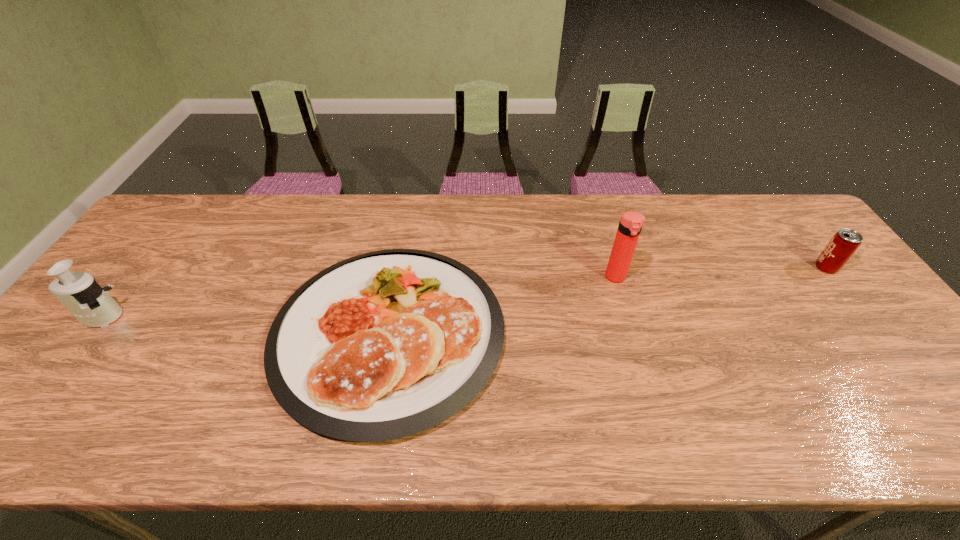
Identify the location of free spot between the thermos bottle and the rightmost object. The width and height of the screenshot is (960, 540). (721, 273).

I want to click on vacant point located between the third tallest object and the third object from right to left, so click(x=608, y=301).

Identify the location of free area in between the second object from left to right and the juicer. The height and width of the screenshot is (540, 960). (245, 325).

Locate an element on the screen. This screenshot has height=540, width=960. free space between the dish and the third object from left to right is located at coordinates (502, 305).

The image size is (960, 540). I want to click on vacant area that lies between the rightmost object and the tallest object, so click(721, 273).

The height and width of the screenshot is (540, 960). Find the location of `free space between the rightmost object and the dish`. free space between the rightmost object and the dish is located at coordinates (608, 301).

Where is `free spot between the second object from left to right and the leftmost object`? The image size is (960, 540). free spot between the second object from left to right and the leftmost object is located at coordinates (245, 325).

Where is `vacant area that lies between the third object from left to right and the dish`? vacant area that lies between the third object from left to right and the dish is located at coordinates [502, 305].

Point out which object is positioned as the nearest to the third tallest object. Please provide its 2D coordinates. Your answer should be formatted as a tuple, i.e. [(x, y)], where the tuple contains the x and y coordinates of a point satisfying the conditions above.

[(631, 223)]

Select which object is the closest to the third shortest object. Please provide its 2D coordinates. Your answer should be formatted as a tuple, i.e. [(x, y)], where the tuple contains the x and y coordinates of a point satisfying the conditions above.

[(383, 345)]